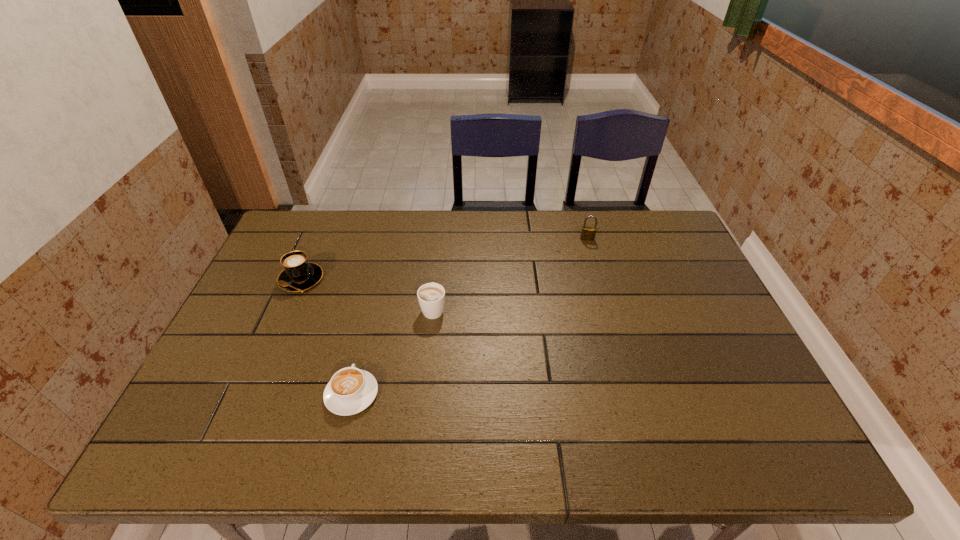
At what (x,y) coordinates should I click in order to perform the action: click on the tallest object. Please return your answer as a coordinate pair (x, y). The height and width of the screenshot is (540, 960). Looking at the image, I should click on (588, 233).

Identify the location of the farthest object. The height and width of the screenshot is (540, 960). (588, 233).

Where is `the leftmost object`? The height and width of the screenshot is (540, 960). the leftmost object is located at coordinates (298, 274).

Find the location of a particular element. The height and width of the screenshot is (540, 960). the leftmost cappuccino is located at coordinates pyautogui.click(x=298, y=274).

The width and height of the screenshot is (960, 540). Identify the location of the second nearest object. (431, 296).

Identify the location of the rightmost cappuccino. The width and height of the screenshot is (960, 540). (431, 296).

Find the location of a particular element. The image size is (960, 540). the second cappuccino from left to right is located at coordinates (351, 390).

Where is `the nearest object`? This screenshot has height=540, width=960. the nearest object is located at coordinates (351, 390).

Locate an element on the screen. vacant region located 0.220m on the right of the padlock is located at coordinates (660, 239).

Locate an element on the screen. This screenshot has width=960, height=540. vacant space located on the right of the leftmost object is located at coordinates tap(367, 279).